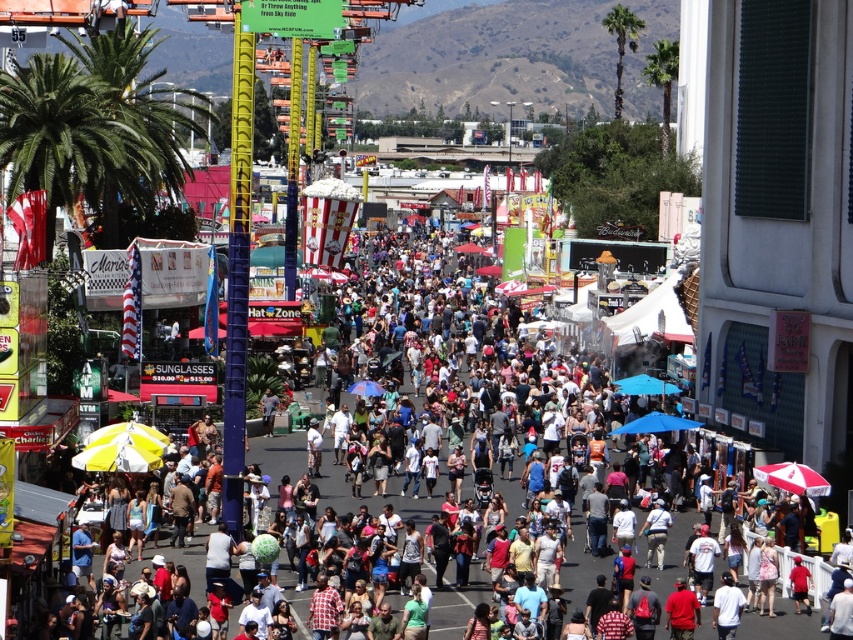
You are a festival attendee who wants to take a photo with both the green leafy palm tree at left and the green leafy palm tree at upper right in the background. Which palm tree should you stand closer to to ensure both are visible in the frame?

You should stand closer to the green leafy palm tree at left because it is smaller than the green leafy palm tree at upper right, so being closer to the smaller one will help balance their sizes in the photo.

You are a festival attendee who wants to take a photo with both the green leafy palm tree at left and the green leafy palm tree at upper right in the background. Considering their distance, do you think you can fit both in your smartphone camera frame at once?

The distance between the green leafy palm tree at left and the green leafy palm tree at upper right is 73.72 meters. Since smartphones typically have a wide enough angle to capture such distances in landscapes, both trees can likely be included in the photo by zooming out fully.

You are a photographer standing in the middle of the festival crowd. You want to take a photo that includes both the green leafy palm tree at upper left and the green leafy palm tree at left. Which palm tree should you position closer to the front of your photo to ensure both are in the frame?

You should position the green leafy palm tree at upper left closer to the front of your photo because it is closer to the viewer than the green leafy palm tree at left, ensuring both are visible in the frame.